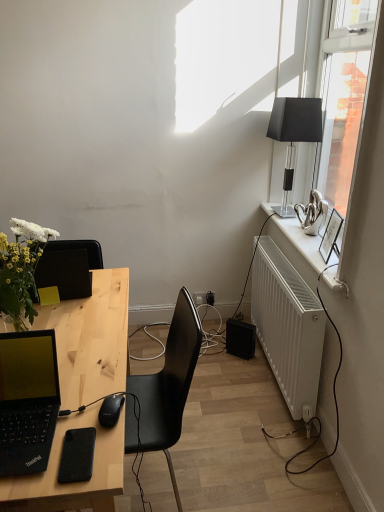
Question: Does natural wood desk at center have a lesser width compared to white matte radiator at right?

Choices:
 (A) yes
 (B) no

Answer: (B)

Question: Is natural wood desk at center shorter than white matte radiator at right?

Choices:
 (A) yes
 (B) no

Answer: (B)

Question: Is natural wood desk at center at the left side of white matte radiator at right?

Choices:
 (A) yes
 (B) no

Answer: (A)

Question: Is natural wood desk at center bigger than white matte radiator at right?

Choices:
 (A) no
 (B) yes

Answer: (B)

Question: Can you confirm if natural wood desk at center is wider than white matte radiator at right?

Choices:
 (A) no
 (B) yes

Answer: (B)

Question: From a real-world perspective, is natural wood desk at center positioned under white matte radiator at right based on gravity?

Choices:
 (A) yes
 (B) no

Answer: (B)

Question: Considering the relative sizes of black matte mouse at lower left and black matte laptop at left in the image provided, is black matte mouse at lower left taller than black matte laptop at left?

Choices:
 (A) no
 (B) yes

Answer: (A)

Question: Is black matte mouse at lower left next to black matte laptop at left?

Choices:
 (A) no
 (B) yes

Answer: (A)

Question: Is black matte mouse at lower left positioned with its back to black matte laptop at left?

Choices:
 (A) no
 (B) yes

Answer: (A)

Question: Is black matte mouse at lower left to the left of black matte laptop at left from the viewer's perspective?

Choices:
 (A) yes
 (B) no

Answer: (B)

Question: From a real-world perspective, is black matte mouse at lower left located beneath black matte laptop at left?

Choices:
 (A) no
 (B) yes

Answer: (B)

Question: Could you tell me if black matte mouse at lower left is turned towards black matte laptop at left?

Choices:
 (A) no
 (B) yes

Answer: (A)

Question: Can you confirm if black matte phone at lower left is smaller than transparent glass window at upper right?

Choices:
 (A) no
 (B) yes

Answer: (B)